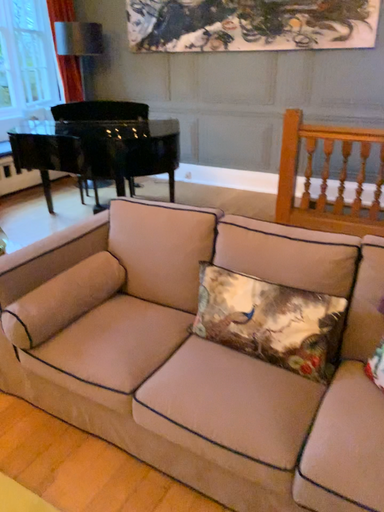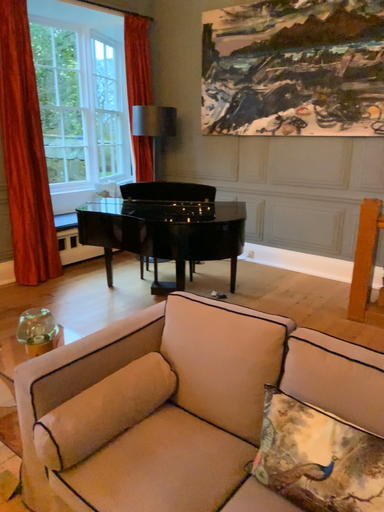
Question: Which way did the camera rotate in the video?

Choices:
 (A) rotated right
 (B) rotated left

Answer: (B)